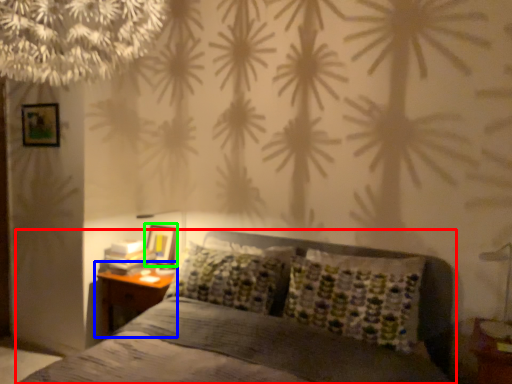
Question: Which is nearer to the bed (highlighted by a red box)? nightstand (highlighted by a blue box) or picture frame (highlighted by a green box).

Choices:
 (A) nightstand
 (B) picture frame

Answer: (A)